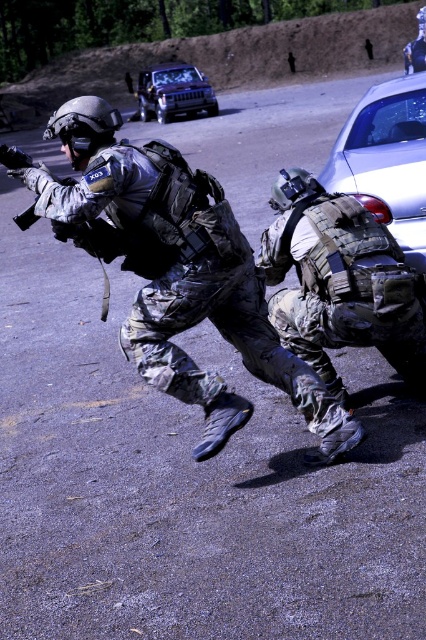
You are a drone operator observing the scene. You need to determine which of the two points, point (45, 216) or point (187, 84), is closer to you. Which one is it?

Point (45, 216) is closer to the camera than point (187, 84).

You are a photographer trying to capture a clear shot of both the camouflage fabric uniform at center and the metallic silver suv at upper center. Given their sizes, which object will require you to zoom in more to fill the frame?

The camouflage fabric uniform at center occupies less space than the metallic silver suv at upper center, so you will need to zoom in more to capture the camouflage fabric uniform at center to fill the frame.